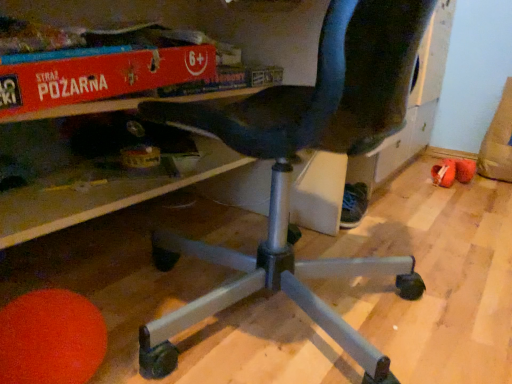
Find the location of a particular element. free area in between black plastic chair at center and orange fabric shoe at lower right, placed as the second footwear when sorted from left to right is located at coordinates (398, 222).